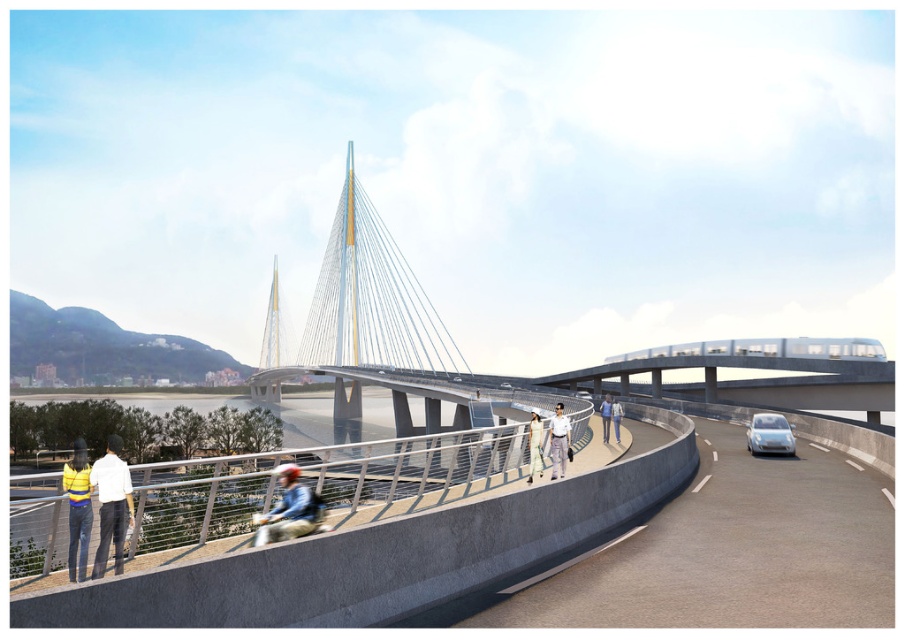
Does blue denim skateboard at center come in front of light blue jeans at center?

Yes, blue denim skateboard at center is closer to the viewer.

Which is in front, point (268, 525) or point (620, 406)?

Point (268, 525) is more forward.

The width and height of the screenshot is (905, 640). I want to click on blue denim skateboard at center, so coord(289,509).

Between blue denim skateboard at center and white uniformed person at center, which one appears on the right side from the viewer's perspective?

From the viewer's perspective, white uniformed person at center appears more on the right side.

Which is behind, point (301, 522) or point (564, 420)?

Point (564, 420)

Identify the location of blue denim skateboard at center. This screenshot has height=640, width=905. (x=289, y=509).

Who is taller, silver metallic car at right or denim jacket at center?

Standing taller between the two is denim jacket at center.

Can you confirm if silver metallic car at right is positioned above denim jacket at center?

Yes.

Identify the location of silver metallic car at right. This screenshot has height=640, width=905. (769, 435).

Locate an element on the screen. This screenshot has width=905, height=640. silver metallic car at right is located at coordinates (769, 435).